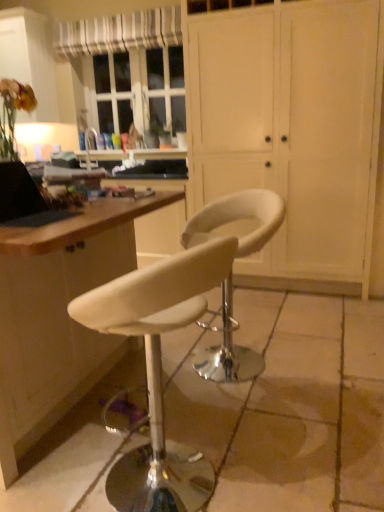
You are a GUI agent. You are given a task and a screenshot of the screen. Output one action in this format:
    pyautogui.click(x=<x>, y=<y>)
    Task: Click on the vacant area that is situated to the right of white leather stool at center, placed as the 1th chair when sorted from front to back
    This screenshot has height=512, width=384.
    Given the screenshot: What is the action you would take?
    pyautogui.click(x=296, y=456)